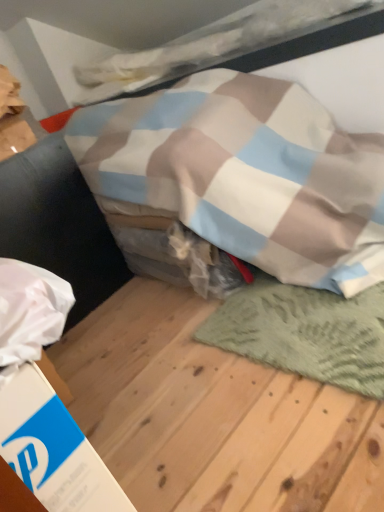
Question: From a real-world perspective, is white cardboard box at lower left positioned above or below green textured rug at lower right?

Choices:
 (A) above
 (B) below

Answer: (A)

Question: In the image, is white cardboard box at lower left on the left side or the right side of green textured rug at lower right?

Choices:
 (A) left
 (B) right

Answer: (A)

Question: Which object is the closest to the green knitted mat at lower right?

Choices:
 (A) white cardboard box at lower left
 (B) green textured rug at lower right

Answer: (B)

Question: Which of these objects is positioned farthest from the white cardboard box at lower left?

Choices:
 (A) green knitted mat at lower right
 (B) green textured rug at lower right

Answer: (A)